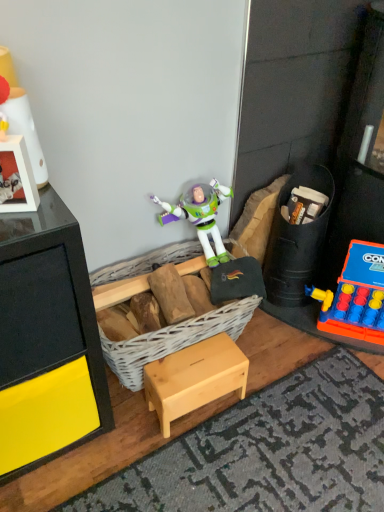
At what (x,y) coordinates should I click in order to perform the action: click on unoccupied area in front of rubberized plastic toy at right, arranged as the 1th toy when viewed from the back. Please return your answer as a coordinate pair (x, y). Image resolution: width=384 pixels, height=512 pixels. Looking at the image, I should click on (289, 328).